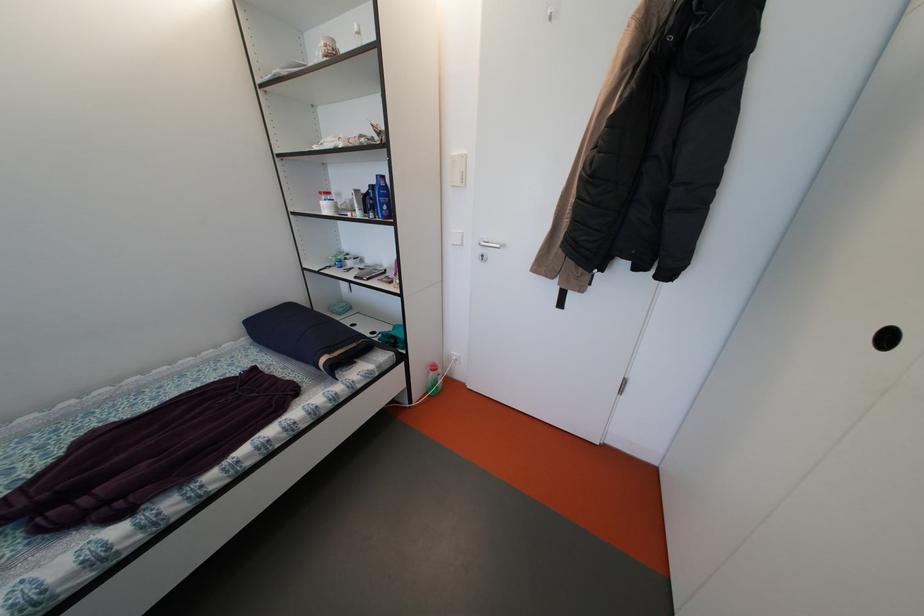
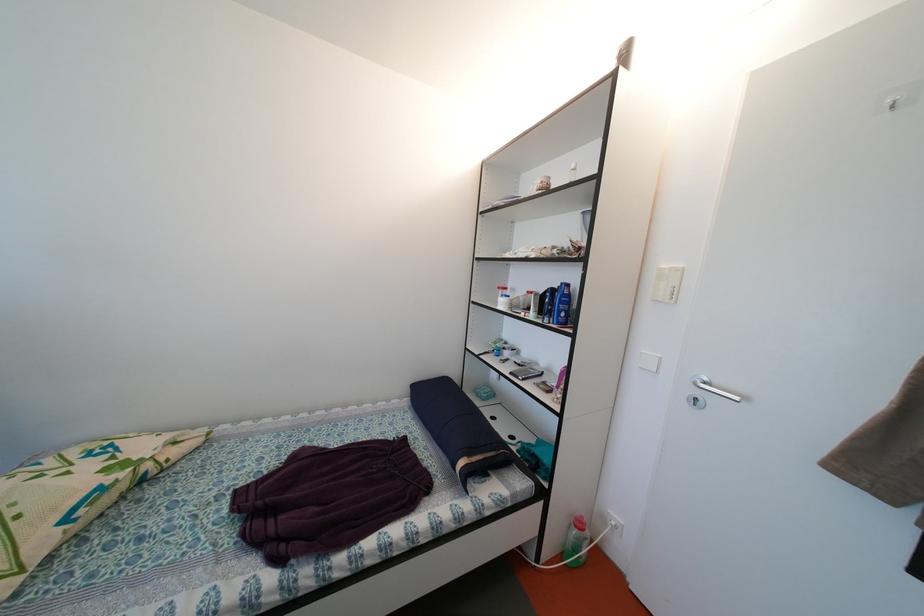
Question: Based on the continuous images, in which direction is the camera rotating? Reply with the corresponding letter.

Choices:
 (A) Left
 (B) Right
 (C) Up
 (D) Down

Answer: (A)